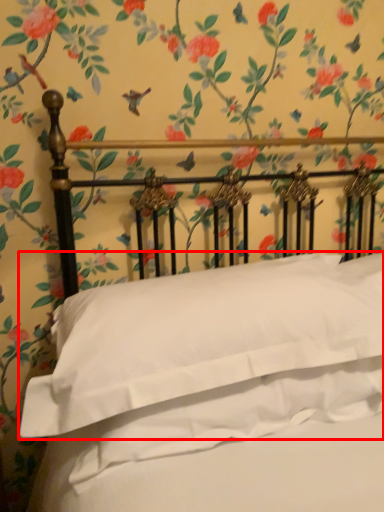
Question: Considering the relative positions of pillow (annotated by the red box) and sheet in the image provided, where is pillow (annotated by the red box) located with respect to the staircase?

Choices:
 (A) right
 (B) left

Answer: (B)